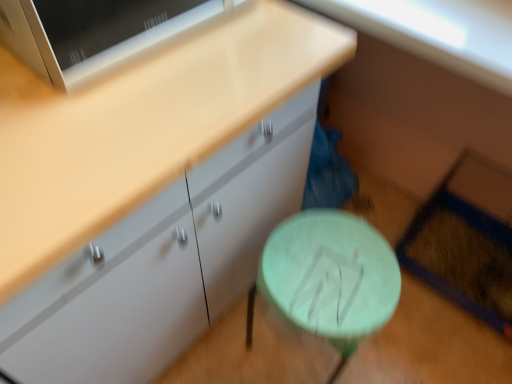
The height and width of the screenshot is (384, 512). What are the coordinates of `free spot below green matte table at lower center (from a real-world perspective)` in the screenshot? It's located at (302, 354).